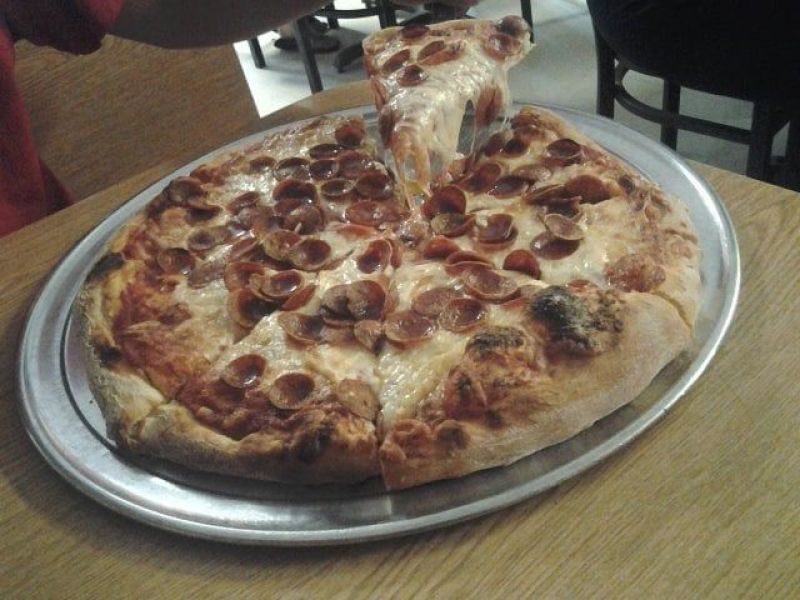
The width and height of the screenshot is (800, 600). I want to click on bottom of chair, so click(677, 72).